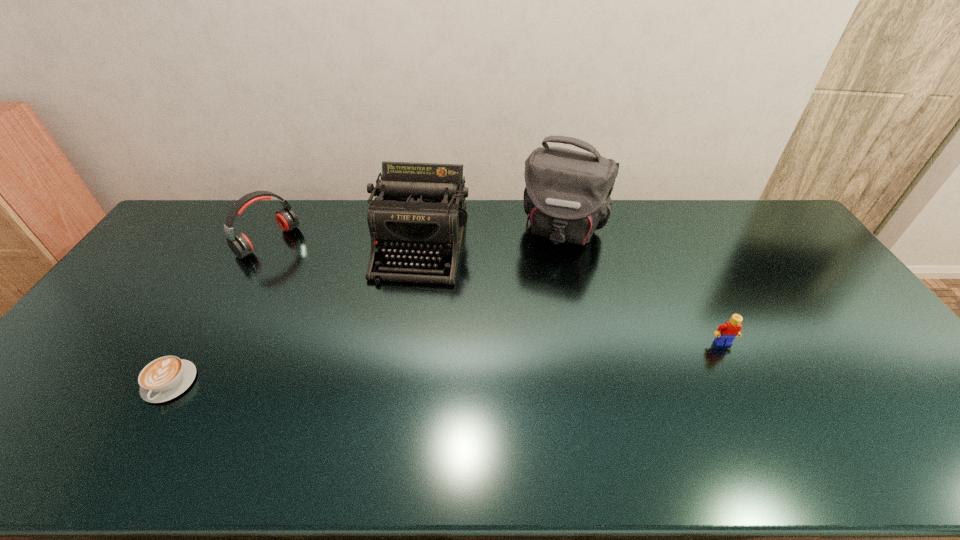
Image resolution: width=960 pixels, height=540 pixels. In order to click on free space located 0.160m on the keyboard of the fourth shortest object in this screenshot , I will do [x=400, y=327].

This screenshot has width=960, height=540. I want to click on free location located on the keyboard of the fourth shortest object, so click(x=396, y=341).

Locate an element on the screen. The height and width of the screenshot is (540, 960). vacant area located 0.380m on the ear cups of the earphone is located at coordinates (362, 306).

In order to click on free space located on the ear cups of the earphone in this screenshot , I will do `click(355, 301)`.

What are the coordinates of `vacant position located on the ear cups of the earphone` in the screenshot? It's located at [326, 282].

In order to click on free space located 0.390m on the open flap of the shoulder bag in this screenshot , I will do `click(526, 345)`.

Where is `vacant area situated on the open flap of the shoulder bag`? The width and height of the screenshot is (960, 540). vacant area situated on the open flap of the shoulder bag is located at coordinates (528, 336).

Where is `free region located on the open flap of the shoulder bag`? This screenshot has width=960, height=540. free region located on the open flap of the shoulder bag is located at coordinates (530, 330).

I want to click on typewriter that is at the far edge, so click(x=419, y=211).

The height and width of the screenshot is (540, 960). Identify the location of earphone at the far edge. (239, 243).